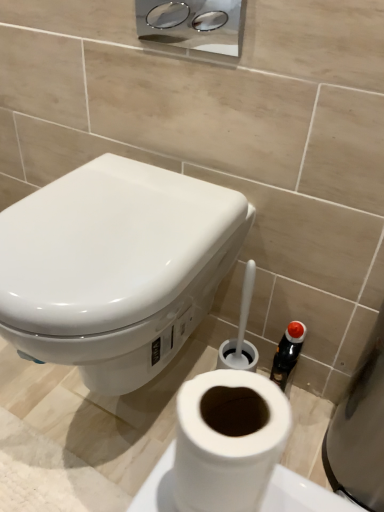
Question: Can you confirm if white glossy toilet at upper left is shorter than chrome metallic dispenser at upper center?

Choices:
 (A) yes
 (B) no

Answer: (B)

Question: Does white glossy toilet at upper left have a larger size compared to chrome metallic dispenser at upper center?

Choices:
 (A) yes
 (B) no

Answer: (A)

Question: Does white glossy toilet at upper left appear on the left side of chrome metallic dispenser at upper center?

Choices:
 (A) yes
 (B) no

Answer: (A)

Question: Is white glossy toilet at upper left to the right of chrome metallic dispenser at upper center from the viewer's perspective?

Choices:
 (A) yes
 (B) no

Answer: (B)

Question: Is white glossy toilet at upper left outside of chrome metallic dispenser at upper center?

Choices:
 (A) no
 (B) yes

Answer: (B)

Question: In terms of size, does white glossy toilet at upper left appear bigger or smaller than chrome metallic dispenser at upper center?

Choices:
 (A) small
 (B) big

Answer: (B)

Question: In terms of width, does white glossy toilet at upper left look wider or thinner when compared to chrome metallic dispenser at upper center?

Choices:
 (A) wide
 (B) thin

Answer: (A)

Question: Considering their positions, is white glossy toilet at upper left located in front of or behind chrome metallic dispenser at upper center?

Choices:
 (A) front
 (B) behind

Answer: (A)

Question: From the image's perspective, is white glossy toilet at upper left positioned above or below chrome metallic dispenser at upper center?

Choices:
 (A) below
 (B) above

Answer: (A)

Question: Is white matte toilet paper at lower center bigger or smaller than chrome metallic dispenser at upper center?

Choices:
 (A) big
 (B) small

Answer: (B)

Question: From the image's perspective, is white matte toilet paper at lower center positioned above or below chrome metallic dispenser at upper center?

Choices:
 (A) below
 (B) above

Answer: (A)

Question: Considering their positions, is white matte toilet paper at lower center located in front of or behind chrome metallic dispenser at upper center?

Choices:
 (A) behind
 (B) front

Answer: (B)

Question: Considering the positions of white matte toilet paper at lower center and chrome metallic dispenser at upper center in the image, is white matte toilet paper at lower center wider or thinner than chrome metallic dispenser at upper center?

Choices:
 (A) thin
 (B) wide

Answer: (B)

Question: Based on their sizes in the image, would you say chrome metallic dispenser at upper center is bigger or smaller than white matte toilet paper at lower center?

Choices:
 (A) big
 (B) small

Answer: (A)

Question: Visually, is chrome metallic dispenser at upper center positioned to the left or to the right of white matte toilet paper at lower center?

Choices:
 (A) left
 (B) right

Answer: (A)